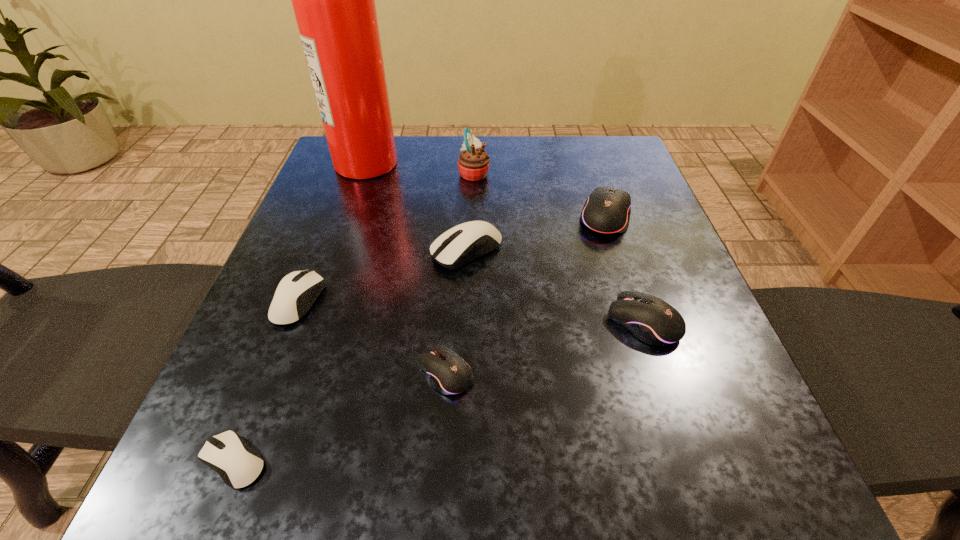
At what (x,y) coordinates should I click in order to perform the action: click on the tallest object. Please return your answer as a coordinate pair (x, y). Image resolution: width=960 pixels, height=540 pixels. Looking at the image, I should click on click(333, 0).

Locate an element on the screen. muffin is located at coordinates (x=473, y=163).

The width and height of the screenshot is (960, 540). What are the coordinates of `the second tallest object` in the screenshot? It's located at (473, 163).

In order to click on the biggest black computer mouse in this screenshot , I will do `click(607, 210)`.

Locate an element on the screen. This screenshot has height=540, width=960. the tallest mouse is located at coordinates (607, 210).

At what (x,y) coordinates should I click in order to perform the action: click on the farthest white mouse. Please return your answer as a coordinate pair (x, y). Looking at the image, I should click on (465, 242).

The height and width of the screenshot is (540, 960). In order to click on the biggest white mouse in this screenshot , I will do `click(465, 242)`.

You are a GUI agent. You are given a task and a screenshot of the screen. Output one action in this format:
    pyautogui.click(x=<x>, y=<y>)
    Task: Click on the second smallest black computer mouse
    This screenshot has height=540, width=960.
    Given the screenshot: What is the action you would take?
    pyautogui.click(x=652, y=320)

I want to click on the second farthest white mouse, so click(x=297, y=291).

Where is `the smallest black computer mouse`? Image resolution: width=960 pixels, height=540 pixels. the smallest black computer mouse is located at coordinates (449, 374).